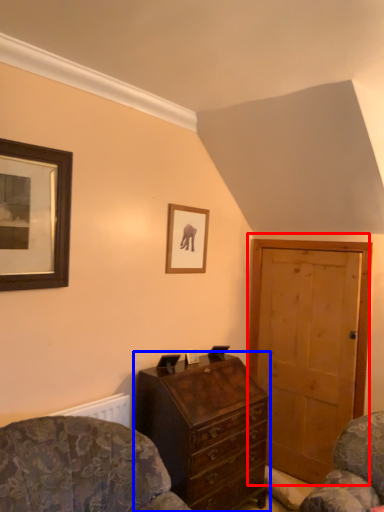
Question: Which object is closer to the camera taking this photo, door (highlighted by a red box) or chest of drawers (highlighted by a blue box)?

Choices:
 (A) door
 (B) chest of drawers

Answer: (B)